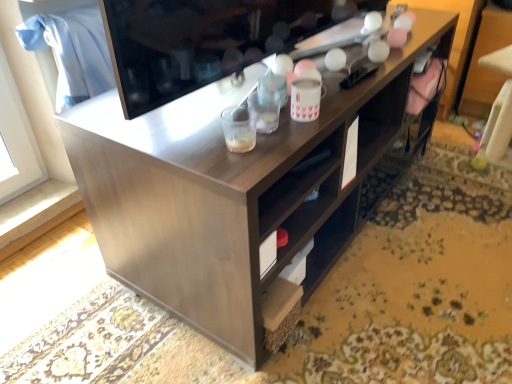
The image size is (512, 384). In order to click on free space to the left of translucent plastic cup at center, the 2th beverage from the right in this screenshot , I will do `click(182, 140)`.